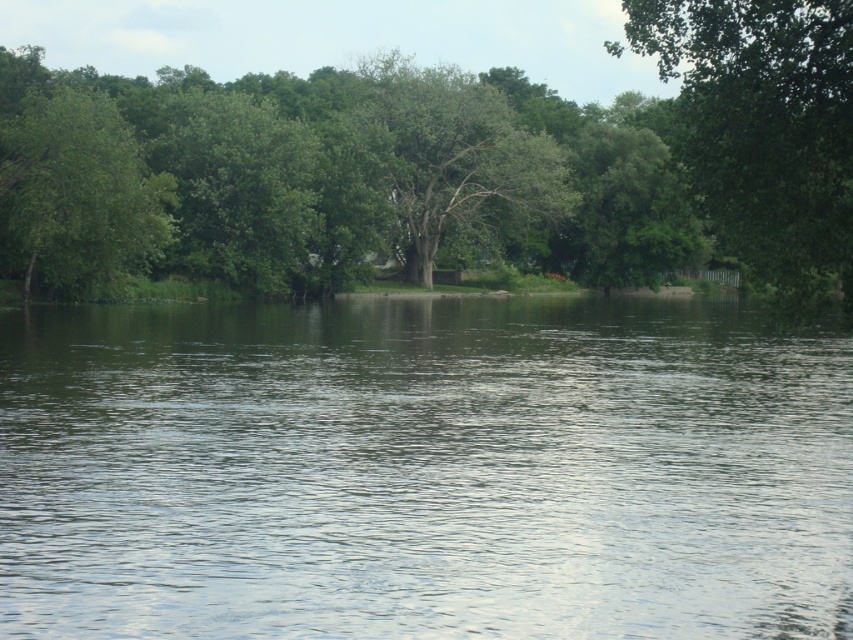
Question: From the image, what is the correct spatial relationship of clear water at center in relation to green leafy tree at left?

Choices:
 (A) left
 (B) right

Answer: (B)

Question: Is green leafy tree at upper right bigger than green leafy tree at left?

Choices:
 (A) no
 (B) yes

Answer: (B)

Question: Which point is farther from the camera taking this photo?

Choices:
 (A) (154, 454)
 (B) (808, 115)
 (C) (20, 273)

Answer: (C)

Question: Considering the relative positions of green leafy tree at upper right and green leafy tree at left in the image provided, where is green leafy tree at upper right located with respect to green leafy tree at left?

Choices:
 (A) left
 (B) right

Answer: (B)

Question: Which of the following is the farthest from the observer?

Choices:
 (A) (206, 381)
 (B) (32, 205)
 (C) (730, 202)

Answer: (B)

Question: Which point is closer to the camera taking this photo?

Choices:
 (A) click(343, 136)
 (B) click(711, 138)
 (C) click(94, 124)

Answer: (B)